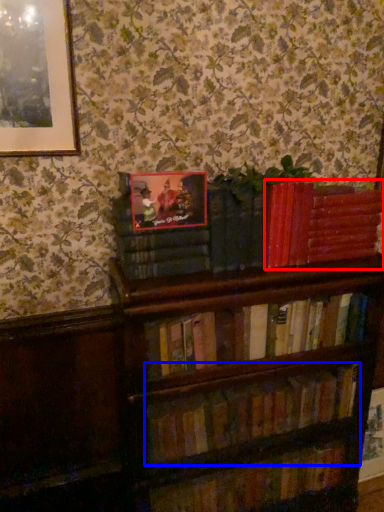
Question: Among these objects, which one is nearest to the camera, book (highlighted by a red box) or book (highlighted by a blue box)?

Choices:
 (A) book
 (B) book

Answer: (B)